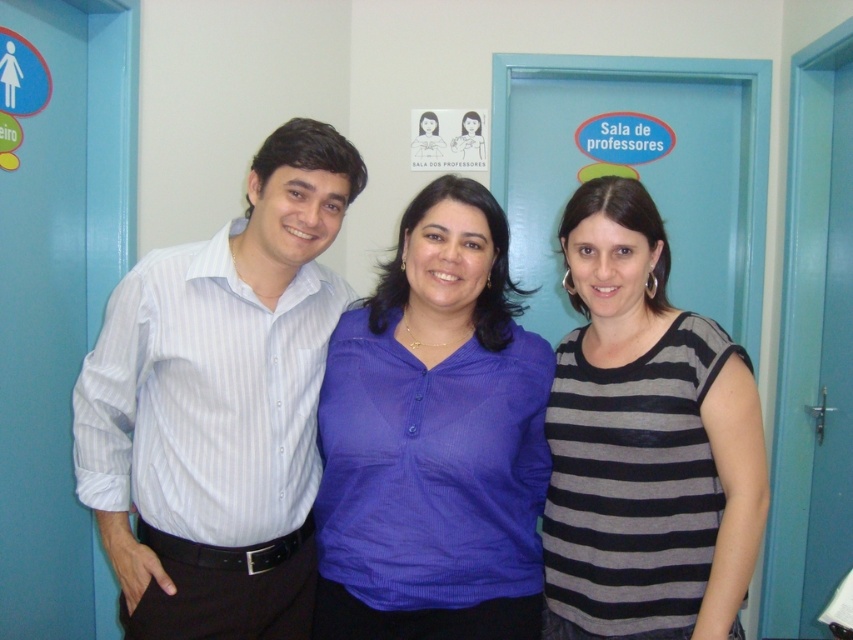
You are standing in front of the light blue and white striped shirt wearing person on the left and the matte blue blouse at center. Which clothing item is positioned closer to the center of the room?

The matte blue blouse at center is located at point (433, 440) which is closer to the center of the room compared to the light blue and white striped shirt on the left.